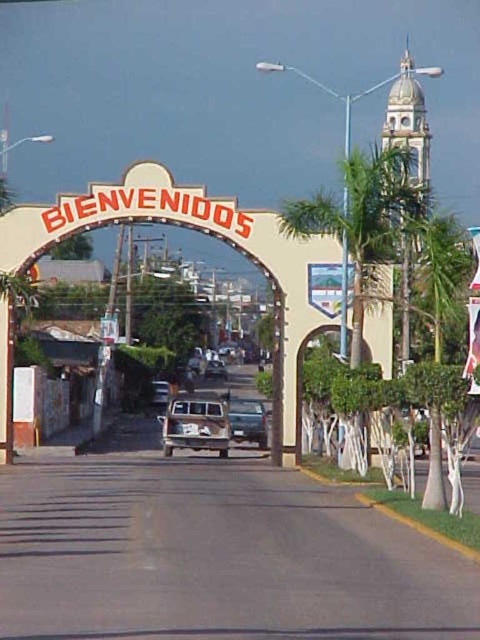
You are a delivery driver who needs to park your vehicle in this area. You have a delivery truck that is 6 meters long. The rusty metal van at center and the matte black truck at center are already parked. Can your delivery truck fit between them if they are parked side by side?

The rusty metal van at center is larger than the matte black truck at center. Since the rusty metal van at center has a larger size, it occupies more space. However, without knowing the exact dimensions of the parked vehicles and the available space between them, it is impossible to determine if the delivery truck will fit. Please check the actual space before attempting to park.

You are a delivery driver who needs to park your vehicle in a spot that can accommodate your truck. The parking spot is exactly the width of the matte black truck at center. You have a truck that is as wide as the rusty metal van at center. Will your truck fit in the parking spot?

The rusty metal van at center is wider than the matte black truck at center. Since the parking spot is the width of the matte black truck at center, your truck, which is as wide as the rusty metal van at center, will not fit in the parking spot.

You are a pedestrian standing at the entrance of the archway. You want to cross the road to the other side. There is a metallic silver car at center and a metallic silver truck at center in front of you. Which vehicle should you wait for first to pass safely?

You should wait for the metallic silver truck at center to pass first because the metallic silver car at center is in front of it, meaning the truck is behind and may need to maneuver around the car, potentially creating a safer moment to cross after both have passed.